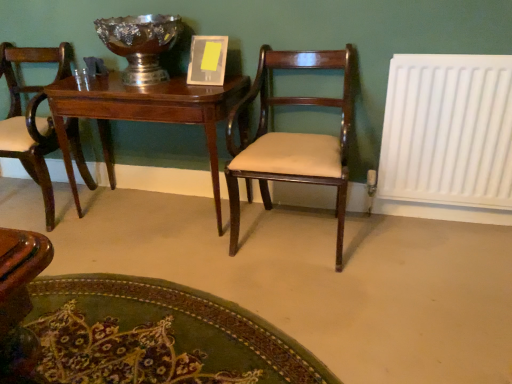
Locate an element on the screen. Image resolution: width=512 pixels, height=384 pixels. white plastic radiator at right is located at coordinates (448, 131).

This screenshot has width=512, height=384. What do you see at coordinates (448, 131) in the screenshot? I see `white plastic radiator at right` at bounding box center [448, 131].

Describe the element at coordinates (144, 114) in the screenshot. I see `mahogany wood table at center` at that location.

Identify the location of white plastic radiator at right. (448, 131).

Who is bigger, matte wood chair at left, the first chair positioned from the left, or white plastic radiator at right?

matte wood chair at left, the first chair positioned from the left, is bigger.

Considering the positions of points (45, 144) and (484, 198), is point (45, 144) farther from camera compared to point (484, 198)?

Yes, point (45, 144) is behind point (484, 198).

Is matte wood chair at left, marked as the 2th chair in a right-to-left arrangement, at the right side of white plastic radiator at right?

Incorrect, matte wood chair at left, marked as the 2th chair in a right-to-left arrangement, is not on the right side of white plastic radiator at right.

Would you consider matte wood chair at left, marked as the 2th chair in a right-to-left arrangement, to be distant from white plastic radiator at right?

Result: Yes, matte wood chair at left, marked as the 2th chair in a right-to-left arrangement, and white plastic radiator at right are located far from each other.

In the scene shown: Can you confirm if mahogany wood table at center is bigger than shiny silver bowl at upper center?

Yes, mahogany wood table at center is bigger than shiny silver bowl at upper center.

At what (x,y) coordinates should I click in order to perform the action: click on glass bowl lying on the left of mahogany wood table at center. Please return your answer as a coordinate pair (x, y). Image resolution: width=512 pixels, height=384 pixels. Looking at the image, I should click on (140, 44).

From a real-world perspective, is mahogany wood table at center physically located above or below shiny silver bowl at upper center?

mahogany wood table at center is below shiny silver bowl at upper center.

Does point (84, 168) appear closer or farther from the camera than point (112, 19)?

Point (84, 168) is positioned farther from the camera compared to point (112, 19).

From the image's perspective, is matte wood chair at left, marked as the 2th chair in a right-to-left arrangement, above or below shiny silver bowl at upper center?

From the image's perspective, matte wood chair at left, marked as the 2th chair in a right-to-left arrangement, appears below shiny silver bowl at upper center.

Is matte wood chair at left, the first chair positioned from the left, oriented away from shiny silver bowl at upper center?

matte wood chair at left, the first chair positioned from the left, is not turned away from shiny silver bowl at upper center.

Considering the positions of objects matte wood chair at left, marked as the 2th chair in a right-to-left arrangement, and shiny silver bowl at upper center in the image provided, who is behind, matte wood chair at left, marked as the 2th chair in a right-to-left arrangement, or shiny silver bowl at upper center?

Positioned behind is matte wood chair at left, marked as the 2th chair in a right-to-left arrangement.

From a real-world perspective, who is located higher, matte wood chair at left, the first chair positioned from the left, or mahogany wood table at center?

From a 3D spatial view, matte wood chair at left, the first chair positioned from the left, is above.

From the picture: Between matte wood chair at left, marked as the 2th chair in a right-to-left arrangement, and mahogany wood table at center, which one has larger width?

Wider between the two is matte wood chair at left, marked as the 2th chair in a right-to-left arrangement.

Does matte wood chair at left, marked as the 2th chair in a right-to-left arrangement, have a greater height compared to mahogany wood table at center?

Yes.

Is matte wood chair at left, marked as the 2th chair in a right-to-left arrangement, far from mahogany wood table at center?

No.

From the image's perspective, which is below, white plastic radiator at right or mahogany wood table at center?

mahogany wood table at center, from the image's perspective.

Is point (497, 61) positioned before point (116, 112)?

Yes, point (497, 61) is in front of point (116, 112).

Where is `chair that is below the white plastic radiator at right (from the image's perspective)`? chair that is below the white plastic radiator at right (from the image's perspective) is located at coordinates (292, 138).

Is mahogany wood chair at center, acting as the first chair starting from the right, not near white plastic radiator at right?

No, mahogany wood chair at center, acting as the first chair starting from the right, is not far from white plastic radiator at right.

Considering the sizes of mahogany wood chair at center, which is the 2th chair in left-to-right order, and white plastic radiator at right in the image, is mahogany wood chair at center, which is the 2th chair in left-to-right order, wider or thinner than white plastic radiator at right?

mahogany wood chair at center, which is the 2th chair in left-to-right order, is wider than white plastic radiator at right.

Is mahogany wood chair at center, acting as the first chair starting from the right, at the right side of white plastic radiator at right?

No.

From a real-world perspective, which object rests below the other?

From a 3D spatial view, matte wood chair at left, the first chair positioned from the left, is below.

Which object is more forward, shiny silver bowl at upper center or matte wood chair at left, the first chair positioned from the left?

Positioned in front is shiny silver bowl at upper center.

Which object is wider, shiny silver bowl at upper center or matte wood chair at left, the first chair positioned from the left?

With larger width is matte wood chair at left, the first chair positioned from the left.

At what (x,y) coordinates should I click in order to perform the action: click on radiator on the right of matte wood chair at left, marked as the 2th chair in a right-to-left arrangement. Please return your answer as a coordinate pair (x, y). This screenshot has width=512, height=384. Looking at the image, I should click on (448, 131).

You are a GUI agent. You are given a task and a screenshot of the screen. Output one action in this format:
    pyautogui.click(x=<x>, y=<y>)
    Task: Click on the table behind the shiny silver bowl at upper center
    The height and width of the screenshot is (384, 512).
    Given the screenshot: What is the action you would take?
    pyautogui.click(x=144, y=114)

Estimate the real-world distances between objects in this image. Which object is closer to white plastic radiator at right, shiny silver bowl at upper center or mahogany wood chair at center, which is the 2th chair in left-to-right order?

Among the two, mahogany wood chair at center, which is the 2th chair in left-to-right order, is located nearer to white plastic radiator at right.

Considering their positions, is mahogany wood chair at center, acting as the first chair starting from the right, positioned closer to mahogany wood table at center than white plastic radiator at right?

mahogany wood chair at center, acting as the first chair starting from the right, is positioned closer to the anchor mahogany wood table at center.

Looking at this image, estimate the real-world distances between objects in this image. Which object is closer to matte wood chair at left, marked as the 2th chair in a right-to-left arrangement, shiny silver bowl at upper center or mahogany wood table at center?

mahogany wood table at center is closer to matte wood chair at left, marked as the 2th chair in a right-to-left arrangement.

Considering their positions, is matte wood chair at left, the first chair positioned from the left, positioned further to shiny silver bowl at upper center than mahogany wood chair at center, acting as the first chair starting from the right?

mahogany wood chair at center, acting as the first chair starting from the right.

Looking at the image, which one is located closer to mahogany wood table at center, shiny silver bowl at upper center or mahogany wood chair at center, acting as the first chair starting from the right?

shiny silver bowl at upper center lies closer to mahogany wood table at center than the other object.

Based on their spatial positions, is matte wood chair at left, marked as the 2th chair in a right-to-left arrangement, or white plastic radiator at right closer to mahogany wood table at center?

matte wood chair at left, marked as the 2th chair in a right-to-left arrangement, lies closer to mahogany wood table at center than the other object.

Estimate the real-world distances between objects in this image. Which object is further from mahogany wood chair at center, which is the 2th chair in left-to-right order, mahogany wood table at center or white plastic radiator at right?

Based on the image, white plastic radiator at right appears to be further to mahogany wood chair at center, which is the 2th chair in left-to-right order.

Looking at this image, looking at the image, which one is located further to matte wood chair at left, marked as the 2th chair in a right-to-left arrangement, shiny silver bowl at upper center or mahogany wood chair at center, acting as the first chair starting from the right?

mahogany wood chair at center, acting as the first chair starting from the right, is further to matte wood chair at left, marked as the 2th chair in a right-to-left arrangement.

What are the coordinates of `glass bowl located between matte wood chair at left, the first chair positioned from the left, and mahogany wood table at center in the left-right direction` in the screenshot? It's located at (140, 44).

This screenshot has width=512, height=384. I want to click on table between shiny silver bowl at upper center and white plastic radiator at right, so tap(144, 114).

Find the location of a particular element. chair between matte wood chair at left, the first chair positioned from the left, and white plastic radiator at right, in the horizontal direction is located at coordinates (292, 138).

Find the location of a particular element. The width and height of the screenshot is (512, 384). chair between shiny silver bowl at upper center and white plastic radiator at right from left to right is located at coordinates (292, 138).